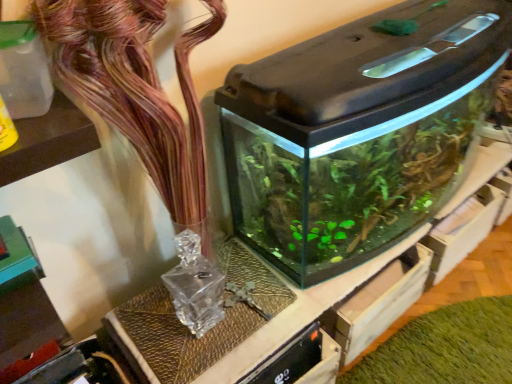
Find the location of a particular element. The height and width of the screenshot is (384, 512). free spot below green matte plant at lower right (from a real-world perspective) is located at coordinates (449, 334).